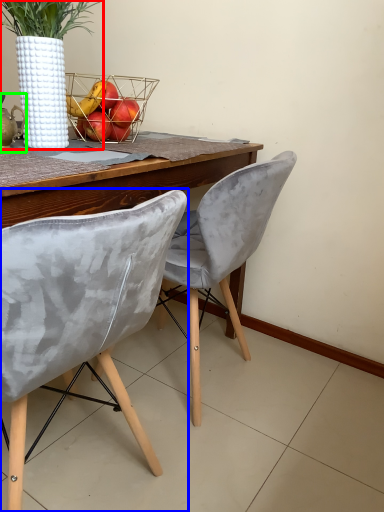
Question: Estimate the real-world distances between objects in this image. Which object is farther from houseplant (highlighted by a red box), chair (highlighted by a blue box) or tea pot (highlighted by a green box)?

Choices:
 (A) chair
 (B) tea pot

Answer: (A)